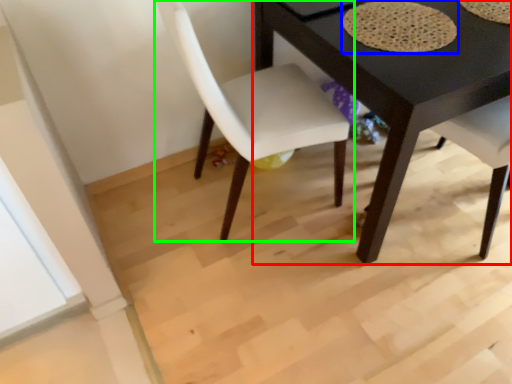
Question: Which object is positioned farthest from table (highlighted by a red box)? Select from mat (highlighted by a blue box) and chair (highlighted by a green box).

Choices:
 (A) mat
 (B) chair

Answer: (B)